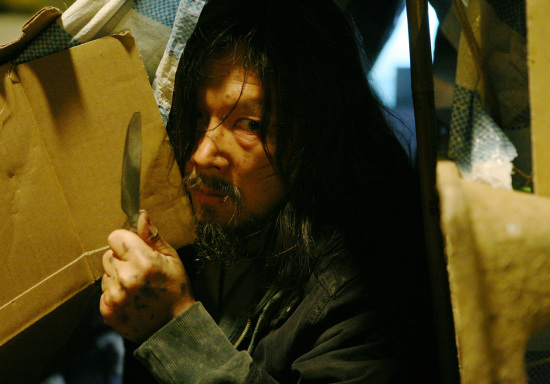
I want to click on blanket, so click(x=162, y=48).